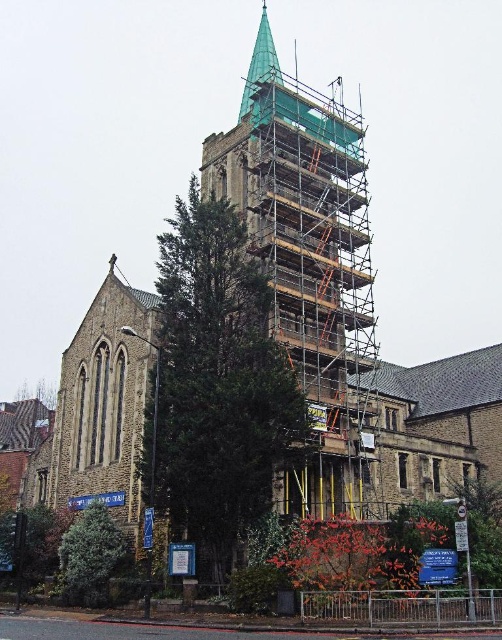
Question: Which of the following is the farthest from the observer?

Choices:
 (A) green textured tree at center
 (B) green metal scaffolding at center
 (C) green textured tree at lower left

Answer: (B)

Question: Does green metal scaffolding at center appear over green glass spire at upper center?

Choices:
 (A) yes
 (B) no

Answer: (B)

Question: Among these objects, which one is nearest to the camera?

Choices:
 (A) green textured tree at center
 (B) green metal scaffolding at center

Answer: (A)

Question: Which point is closer to the camera taking this photo?

Choices:
 (A) [x=287, y=397]
 (B) [x=350, y=500]

Answer: (A)

Question: Where is green textured tree at center located in relation to green textured tree at lower left in the image?

Choices:
 (A) right
 (B) left

Answer: (A)

Question: Can you confirm if green metal scaffolding at center is wider than green glass spire at upper center?

Choices:
 (A) yes
 (B) no

Answer: (A)